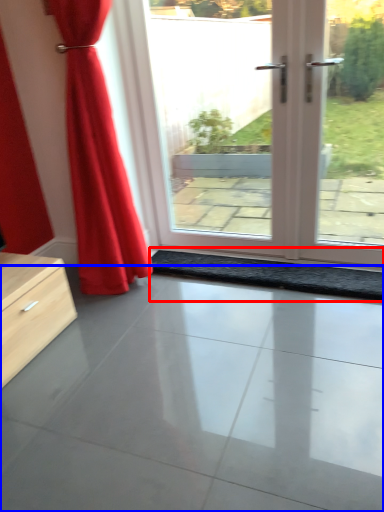
Question: Which of the following is the closest to the observer, doormat (highlighted by a red box) or concrete (highlighted by a blue box)?

Choices:
 (A) doormat
 (B) concrete

Answer: (B)